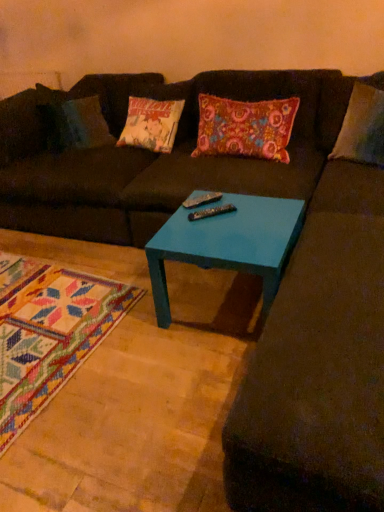
Locate an element on the screen. vacant area that is in front of black plastic remote at center, the second remote when ordered from back to front is located at coordinates (211, 233).